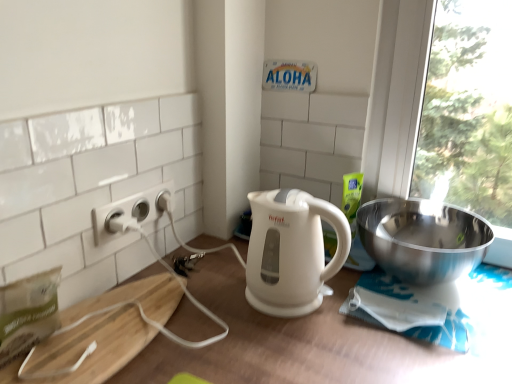
Question: Is white matte table at center thinner than polished stainless steel bowl at right?

Choices:
 (A) no
 (B) yes

Answer: (A)

Question: Is white matte table at center not close to polished stainless steel bowl at right?

Choices:
 (A) no
 (B) yes

Answer: (A)

Question: Does white matte table at center have a lesser height compared to polished stainless steel bowl at right?

Choices:
 (A) yes
 (B) no

Answer: (B)

Question: Is white matte table at center looking in the opposite direction of polished stainless steel bowl at right?

Choices:
 (A) yes
 (B) no

Answer: (B)

Question: Does white matte table at center have a greater height compared to polished stainless steel bowl at right?

Choices:
 (A) no
 (B) yes

Answer: (B)

Question: Is white matte table at center to the left of polished stainless steel bowl at right from the viewer's perspective?

Choices:
 (A) yes
 (B) no

Answer: (A)

Question: Considering the relative positions of polished stainless steel bowl at right and white glossy electric kettle at center in the image provided, is polished stainless steel bowl at right to the left of white glossy electric kettle at center from the viewer's perspective?

Choices:
 (A) yes
 (B) no

Answer: (B)

Question: Does polished stainless steel bowl at right have a lesser height compared to white glossy electric kettle at center?

Choices:
 (A) yes
 (B) no

Answer: (A)

Question: Is the position of polished stainless steel bowl at right less distant than that of white glossy electric kettle at center?

Choices:
 (A) yes
 (B) no

Answer: (B)

Question: Considering the relative sizes of polished stainless steel bowl at right and white glossy electric kettle at center in the image provided, is polished stainless steel bowl at right bigger than white glossy electric kettle at center?

Choices:
 (A) yes
 (B) no

Answer: (A)

Question: Is polished stainless steel bowl at right at the right side of white glossy electric kettle at center?

Choices:
 (A) no
 (B) yes

Answer: (B)

Question: Are polished stainless steel bowl at right and white glossy electric kettle at center located far from each other?

Choices:
 (A) yes
 (B) no

Answer: (B)

Question: Does white plastic power outlet at left have a greater width compared to white matte table at center?

Choices:
 (A) no
 (B) yes

Answer: (A)